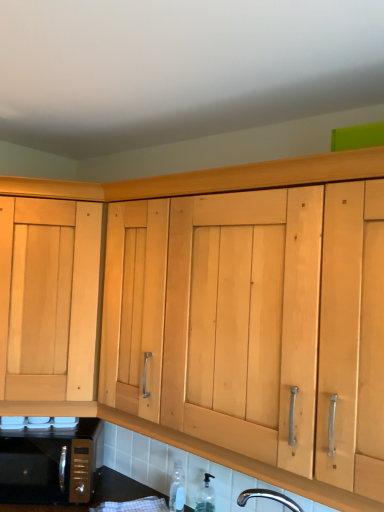
Question: Is transparent plastic bottle at lower center, which is the 1th bottle from left to right, not within light wood cabinet at left?

Choices:
 (A) no
 (B) yes

Answer: (B)

Question: Is transparent plastic bottle at lower center, acting as the second bottle starting from the right, at the left side of light wood cabinet at left?

Choices:
 (A) yes
 (B) no

Answer: (B)

Question: Are transparent plastic bottle at lower center, acting as the second bottle starting from the right, and light wood cabinet at left far apart?

Choices:
 (A) yes
 (B) no

Answer: (B)

Question: Does transparent plastic bottle at lower center, acting as the second bottle starting from the right, lie in front of light wood cabinet at left?

Choices:
 (A) yes
 (B) no

Answer: (B)

Question: Considering the relative sizes of transparent plastic bottle at lower center, which is the 1th bottle from left to right, and light wood cabinet at left in the image provided, is transparent plastic bottle at lower center, which is the 1th bottle from left to right, bigger than light wood cabinet at left?

Choices:
 (A) yes
 (B) no

Answer: (B)

Question: Is black metallic microwave at lower left inside or outside of clear glass bottle at lower center, which appears as the first bottle when viewed from the right?

Choices:
 (A) outside
 (B) inside

Answer: (A)

Question: In terms of height, does black metallic microwave at lower left look taller or shorter compared to clear glass bottle at lower center, marked as the second bottle in a left-to-right arrangement?

Choices:
 (A) tall
 (B) short

Answer: (A)

Question: Visually, is black metallic microwave at lower left positioned to the left or to the right of clear glass bottle at lower center, marked as the second bottle in a left-to-right arrangement?

Choices:
 (A) left
 (B) right

Answer: (A)

Question: Is black metallic microwave at lower left bigger or smaller than clear glass bottle at lower center, marked as the second bottle in a left-to-right arrangement?

Choices:
 (A) big
 (B) small

Answer: (A)

Question: Considering the positions of light wood cabinet at left and transparent plastic bottle at lower center, acting as the second bottle starting from the right, in the image, is light wood cabinet at left bigger or smaller than transparent plastic bottle at lower center, acting as the second bottle starting from the right,?

Choices:
 (A) small
 (B) big

Answer: (B)

Question: Is light wood cabinet at left situated inside transparent plastic bottle at lower center, acting as the second bottle starting from the right, or outside?

Choices:
 (A) outside
 (B) inside

Answer: (A)

Question: From a real-world perspective, is light wood cabinet at left above or below transparent plastic bottle at lower center, which is the 1th bottle from left to right?

Choices:
 (A) above
 (B) below

Answer: (A)

Question: Is light wood cabinet at left to the left or to the right of transparent plastic bottle at lower center, which is the 1th bottle from left to right, in the image?

Choices:
 (A) right
 (B) left

Answer: (B)

Question: Is clear glass bottle at lower center, marked as the second bottle in a left-to-right arrangement, to the left or to the right of light wood cabinet at left in the image?

Choices:
 (A) left
 (B) right

Answer: (B)

Question: From the image's perspective, relative to light wood cabinet at left, is clear glass bottle at lower center, which appears as the first bottle when viewed from the right, above or below?

Choices:
 (A) below
 (B) above

Answer: (A)